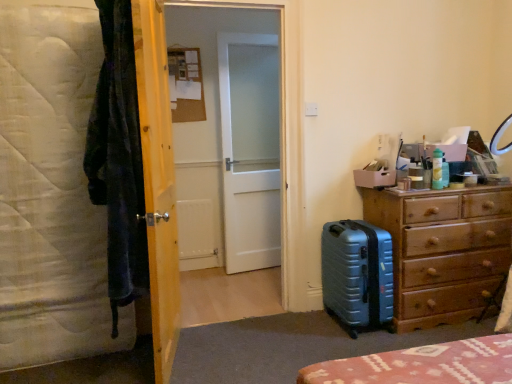
Identify the location of free space between metallic blue suitcase at lower right and white quilted mattress at left. (246, 334).